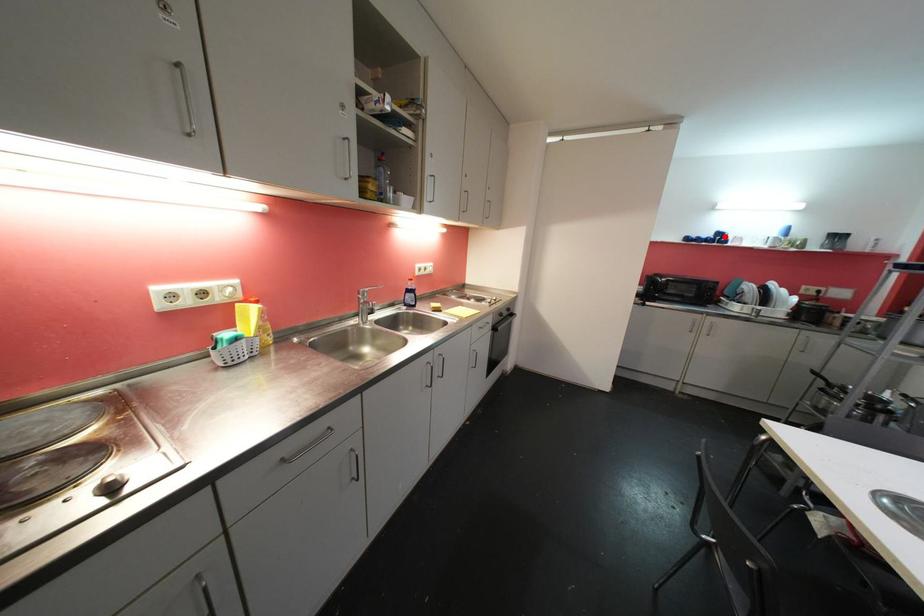
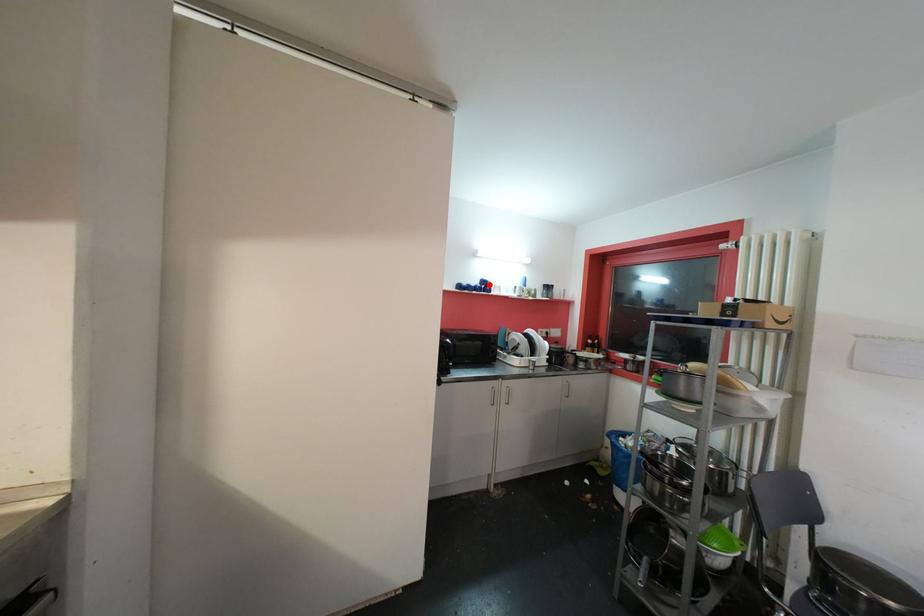
I am providing you with two images of the same scene from different viewpoints. A red point is marked on the first image and another point is marked on the second image. Are the points marked in image1 and image2 representing the same 3D position?

Yes